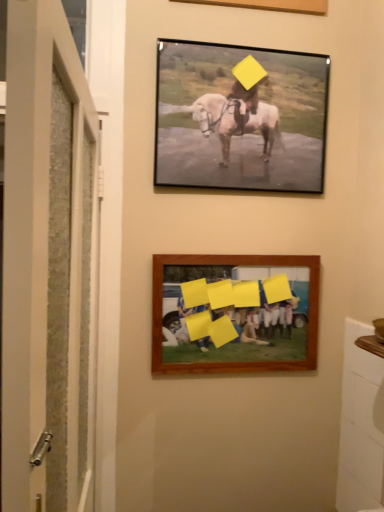
Question: Is wooden frame at lower center, which appears as the 2th picture frame when viewed from the top, further to camera compared to matte black frame at upper center, the 2th picture frame ordered from the bottom?

Choices:
 (A) no
 (B) yes

Answer: (B)

Question: Would you say wooden frame at lower center, which appears as the 2th picture frame when viewed from the top, is a long distance from matte black frame at upper center, which ranks as the first picture frame in top-to-bottom order?

Choices:
 (A) yes
 (B) no

Answer: (B)

Question: Considering the relative sizes of wooden frame at lower center, which appears as the 2th picture frame when viewed from the top, and matte black frame at upper center, which ranks as the first picture frame in top-to-bottom order, in the image provided, is wooden frame at lower center, which appears as the 2th picture frame when viewed from the top, bigger than matte black frame at upper center, which ranks as the first picture frame in top-to-bottom order,?

Choices:
 (A) no
 (B) yes

Answer: (A)

Question: From a real-world perspective, is wooden frame at lower center, which appears as the 2th picture frame when viewed from the top, under matte black frame at upper center, which ranks as the first picture frame in top-to-bottom order?

Choices:
 (A) yes
 (B) no

Answer: (A)

Question: Can you confirm if wooden frame at lower center, placed as the 1th picture frame when sorted from bottom to top, is shorter than matte black frame at upper center, the 2th picture frame ordered from the bottom?

Choices:
 (A) yes
 (B) no

Answer: (A)

Question: Relative to wooden frame at lower center, placed as the 1th picture frame when sorted from bottom to top, is matte black frame at upper center, the 2th picture frame ordered from the bottom, in front or behind?

Choices:
 (A) behind
 (B) front

Answer: (B)

Question: Based on their sizes in the image, would you say matte black frame at upper center, the 2th picture frame ordered from the bottom, is bigger or smaller than wooden frame at lower center, which appears as the 2th picture frame when viewed from the top?

Choices:
 (A) big
 (B) small

Answer: (A)

Question: Considering the positions of matte black frame at upper center, which ranks as the first picture frame in top-to-bottom order, and wooden frame at lower center, which appears as the 2th picture frame when viewed from the top, in the image, is matte black frame at upper center, which ranks as the first picture frame in top-to-bottom order, wider or thinner than wooden frame at lower center, which appears as the 2th picture frame when viewed from the top,?

Choices:
 (A) wide
 (B) thin

Answer: (A)

Question: Does point (168, 39) appear closer or farther from the camera than point (269, 360)?

Choices:
 (A) closer
 (B) farther

Answer: (A)

Question: Relative to white textured door at left, is matte black frame at upper center, which ranks as the first picture frame in top-to-bottom order, in front or behind?

Choices:
 (A) behind
 (B) front

Answer: (A)

Question: Looking at their shapes, would you say matte black frame at upper center, which ranks as the first picture frame in top-to-bottom order, is wider or thinner than white textured door at left?

Choices:
 (A) thin
 (B) wide

Answer: (A)

Question: From a real-world perspective, is matte black frame at upper center, which ranks as the first picture frame in top-to-bottom order, physically located above or below white textured door at left?

Choices:
 (A) above
 (B) below

Answer: (A)

Question: From the image's perspective, relative to white textured door at left, is matte black frame at upper center, the 2th picture frame ordered from the bottom, above or below?

Choices:
 (A) above
 (B) below

Answer: (A)

Question: Is white textured door at left wider or thinner than matte black frame at upper center, the 2th picture frame ordered from the bottom?

Choices:
 (A) wide
 (B) thin

Answer: (A)

Question: Considering the positions of point (43, 115) and point (170, 131), is point (43, 115) closer or farther from the camera than point (170, 131)?

Choices:
 (A) closer
 (B) farther

Answer: (A)